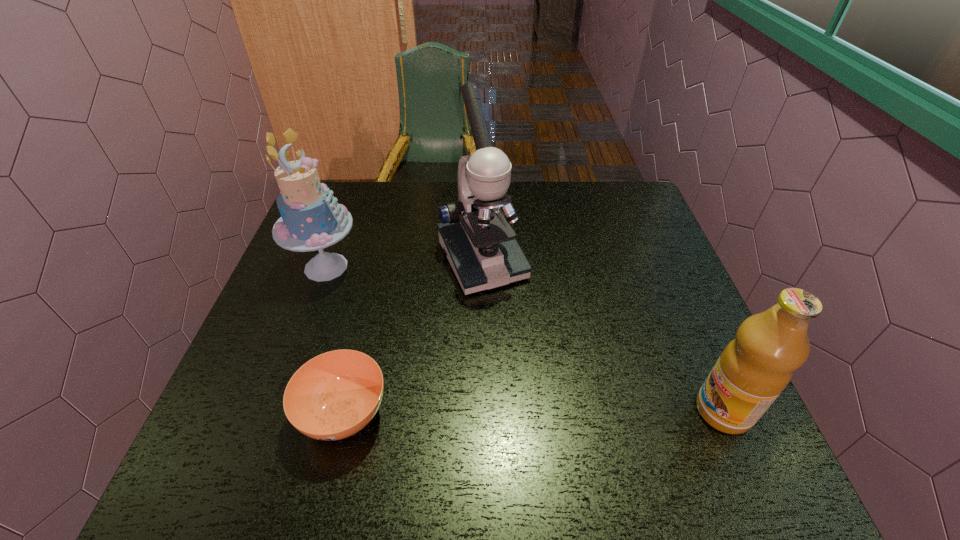
You are a GUI agent. You are given a task and a screenshot of the screen. Output one action in this format:
    pyautogui.click(x=<x>, y=<y>)
    Task: Click on the object present at the near left corner
    The image size is (960, 540).
    Given the screenshot: What is the action you would take?
    pyautogui.click(x=334, y=395)

You are a GUI agent. You are given a task and a screenshot of the screen. Output one action in this format:
    pyautogui.click(x=<x>, y=<y>)
    Task: Click on the object that is positioned at the near right corner
    The image size is (960, 540).
    Given the screenshot: What is the action you would take?
    754,368

What are the coordinates of `vacant space at the far edge` in the screenshot? It's located at (558, 187).

In the image, there is a desktop. Where is `vacant area at the near edge`? The width and height of the screenshot is (960, 540). vacant area at the near edge is located at coordinates (644, 426).

Where is `blank space at the left edge of the desktop`? Image resolution: width=960 pixels, height=540 pixels. blank space at the left edge of the desktop is located at coordinates (252, 338).

Where is `free spot at the right edge of the desktop`? The height and width of the screenshot is (540, 960). free spot at the right edge of the desktop is located at coordinates (683, 345).

Locate an element on the screen. This screenshot has height=540, width=960. vacant space at the near left corner of the desktop is located at coordinates (219, 420).

This screenshot has width=960, height=540. In order to click on vacant space at the far right corner of the desktop in this screenshot , I will do `click(618, 198)`.

Find the location of a particular element. The image size is (960, 540). free point between the third shortest object and the soup bowl is located at coordinates point(335,340).

Identify the location of free space between the second tallest object and the soup bowl. The image size is (960, 540). (335, 340).